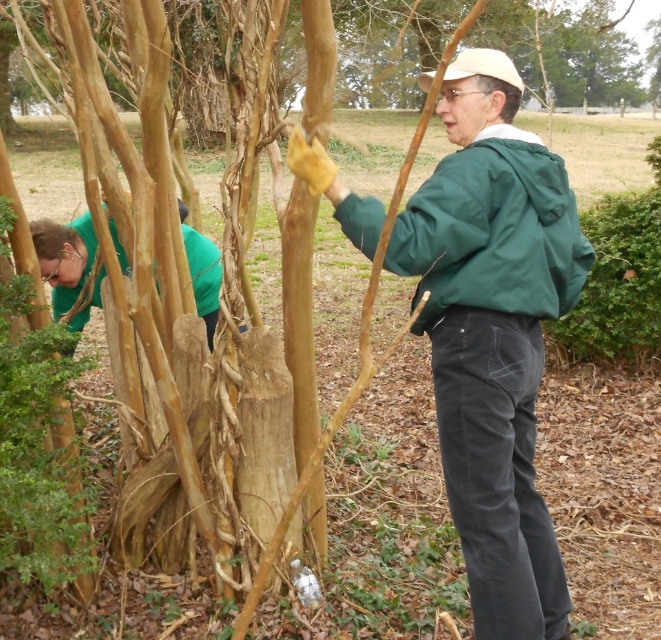
Does green matte jacket at right appear under green matte shirt at left?

Correct, green matte jacket at right is located below green matte shirt at left.

Looking at this image, which of these two, green matte jacket at right or green matte shirt at left, stands shorter?

green matte shirt at left

Image resolution: width=661 pixels, height=640 pixels. Identify the location of green matte jacket at right. (492, 230).

Locate an element on the screen. green matte jacket at right is located at coordinates (492, 230).

Which is behind, point (444, 381) or point (395, 234)?

The point (444, 381) is more distant.

Does green matte jacket at center have a larger size compared to green matte jacket at right?

Indeed, green matte jacket at center has a larger size compared to green matte jacket at right.

The width and height of the screenshot is (661, 640). Find the location of `green matte jacket at center`. green matte jacket at center is located at coordinates (492, 333).

The height and width of the screenshot is (640, 661). What do you see at coordinates (492, 333) in the screenshot? I see `green matte jacket at center` at bounding box center [492, 333].

Identify the location of green matte jacket at center. The height and width of the screenshot is (640, 661). (492, 333).

The width and height of the screenshot is (661, 640). In order to click on green matte jacket at center in this screenshot , I will do `click(492, 333)`.